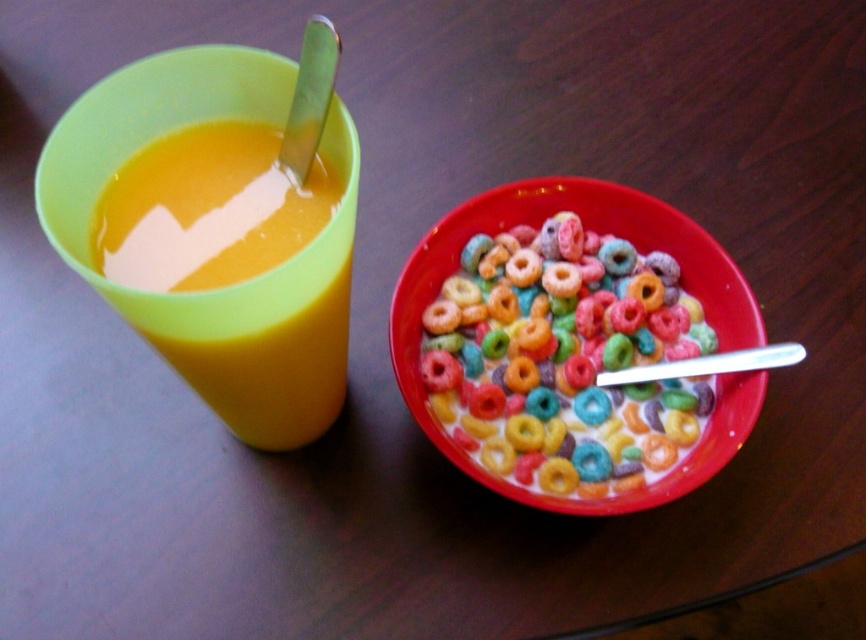
Is multicolored plastic cereal at center in front of translucent plastic cup at left?

No, multicolored plastic cereal at center is further to the viewer.

The image size is (866, 640). Describe the element at coordinates (563, 356) in the screenshot. I see `multicolored plastic cereal at center` at that location.

What are the coordinates of `multicolored plastic cereal at center` in the screenshot? It's located at (563, 356).